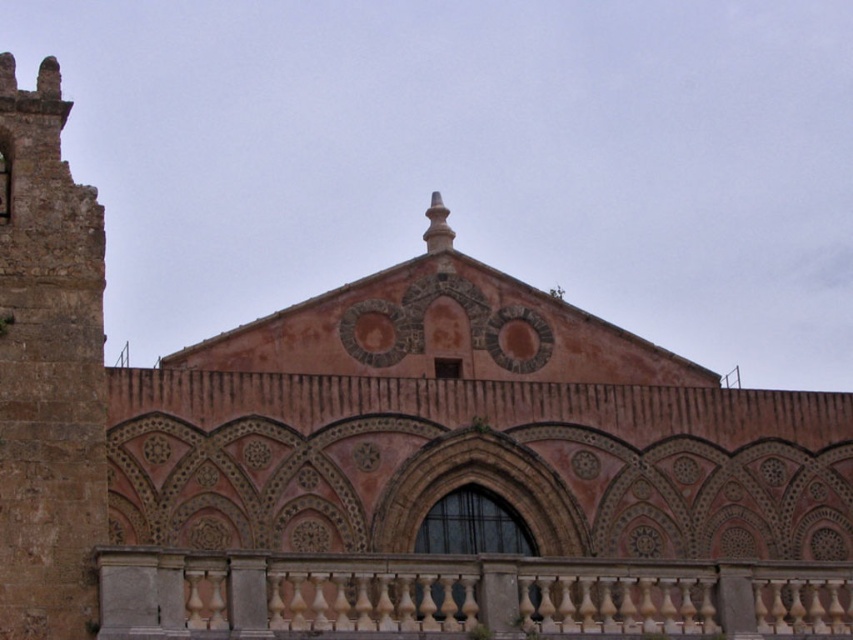
Question: Can you confirm if beige marble balustrade at lower center is wider than rustic stone tower at left?

Choices:
 (A) yes
 (B) no

Answer: (A)

Question: Which point is closer to the camera?

Choices:
 (A) (618, 621)
 (B) (57, 198)

Answer: (B)

Question: Is beige marble balustrade at lower center below rustic stone tower at left?

Choices:
 (A) no
 (B) yes

Answer: (B)

Question: Which point is farther to the camera?

Choices:
 (A) (254, 616)
 (B) (85, 269)

Answer: (B)

Question: Is beige marble balustrade at lower center positioned behind rustic stone tower at left?

Choices:
 (A) yes
 (B) no

Answer: (B)